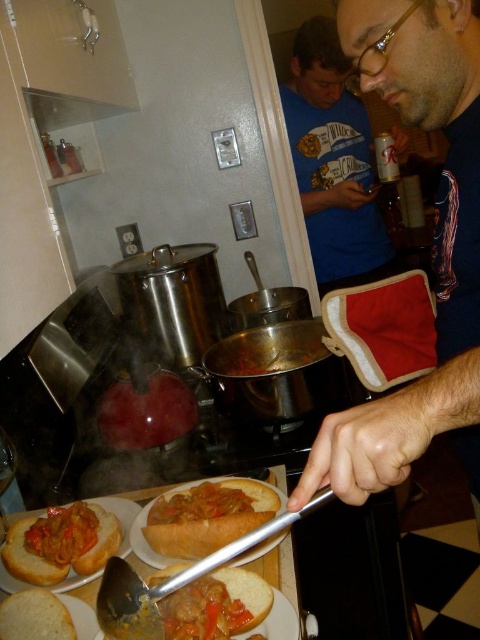
You are standing in the kitchen and want to reach both the point at coordinates (298,84) and the point at (153,605). Which point is closer to you?

The point at coordinates (298,84) is closer to you because it is further to the viewer than the point at (153,605).

You are a chef in this kitchen and need to know which object is shorter between the matte black oven mitt at center and the matte blue shirt at upper center. Can you tell me?

The matte black oven mitt at center is not as tall as the matte blue shirt at upper center, so the matte black oven mitt at center is shorter.

You are standing in the kitchen and need to locate the matte blue shirt at upper center. Based on the coordinates provided, where would you look to find it?

The matte blue shirt at upper center is located at coordinates point (333, 161).